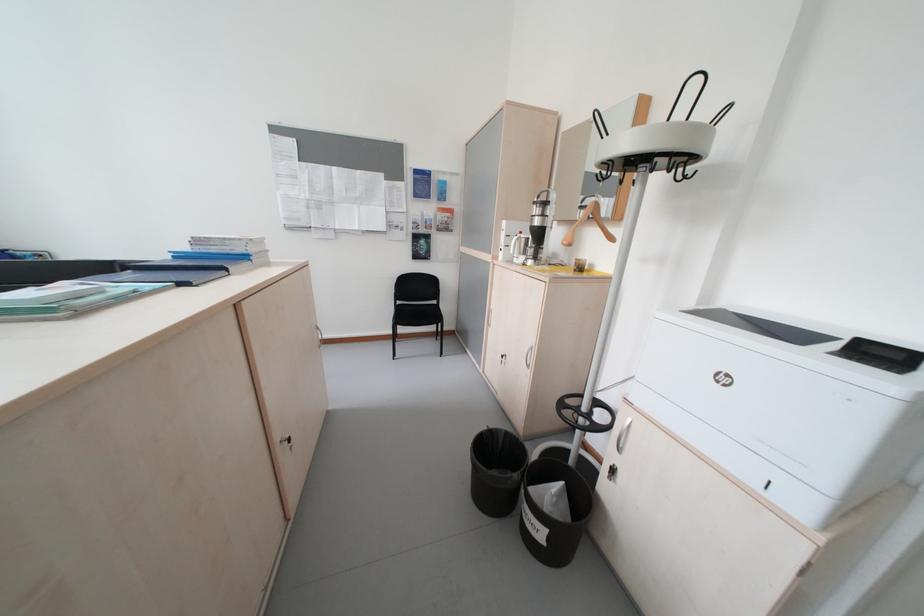
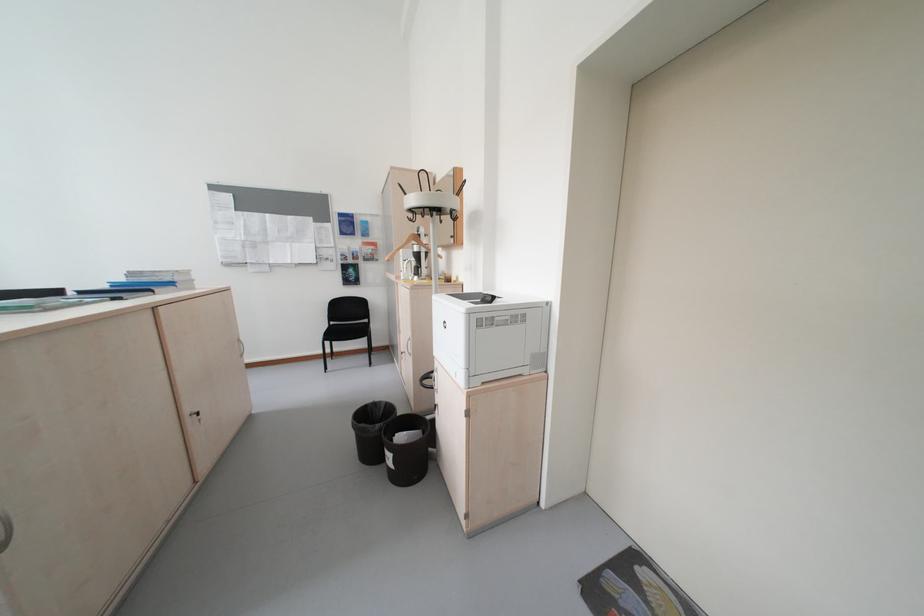
In the second image, find the point that corresponds to point (408, 304) in the first image.

(343, 323)